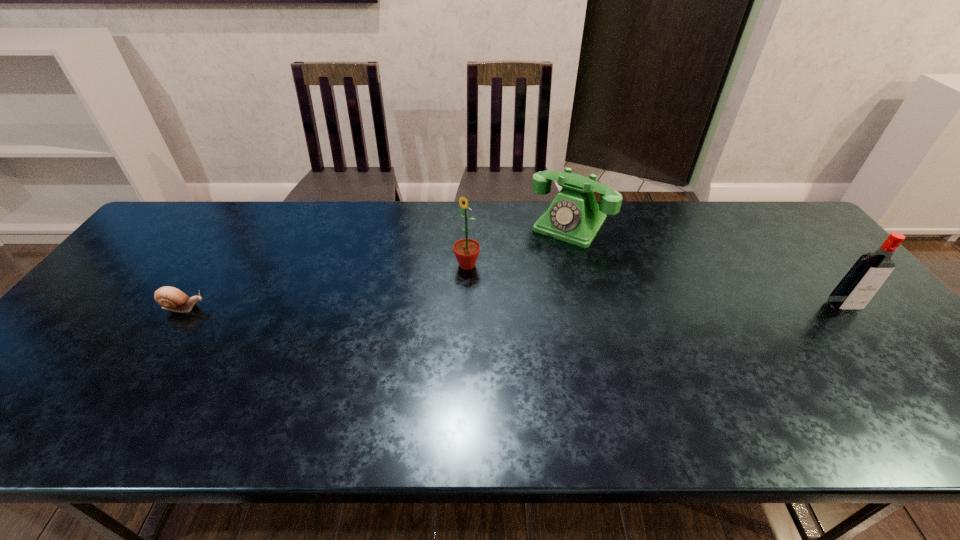
At what (x,y) coordinates should I click in order to perform the action: click on vacant space at the right edge of the desktop. Please return your answer as a coordinate pair (x, y). The image size is (960, 540). Looking at the image, I should click on (826, 253).

At what (x,y) coordinates should I click in order to perform the action: click on vacant space in between the third object from right to left and the leftmost object. Please return your answer as a coordinate pair (x, y). This screenshot has height=540, width=960. Looking at the image, I should click on (325, 286).

At what (x,y) coordinates should I click in order to perform the action: click on free area in between the rightmost object and the shortest object. Please return your answer as a coordinate pair (x, y). Looking at the image, I should click on (514, 307).

You are a GUI agent. You are given a task and a screenshot of the screen. Output one action in this format:
    pyautogui.click(x=<x>, y=<y>)
    Task: Click on the free spot between the sunflower and the vodka
    This screenshot has height=540, width=960.
    Given the screenshot: What is the action you would take?
    pyautogui.click(x=655, y=286)

At what (x,y) coordinates should I click in order to perform the action: click on vacant point located between the leftmost object and the farthest object. Please return your answer as a coordinate pair (x, y). Looking at the image, I should click on (377, 266).

Find the location of `vacant area between the leftmost object and the vodka`. vacant area between the leftmost object and the vodka is located at coordinates (514, 307).

Identify the location of free spot between the escargot and the second farthest object. (325, 286).

Image resolution: width=960 pixels, height=540 pixels. Identify the location of free space between the rightmost object and the sunflower. (655, 286).

Locate an element on the screen. empty location between the escargot and the sunflower is located at coordinates (325, 286).

Locate an element on the screen. The height and width of the screenshot is (540, 960). vacant area that lies between the third tallest object and the vodka is located at coordinates (707, 266).